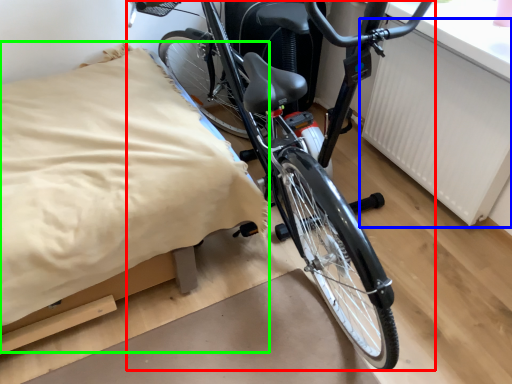
Question: Considering the real-world distances, which object is farthest from bicycle (highlighted by a red box)? radiator (highlighted by a blue box) or sheet (highlighted by a green box)?

Choices:
 (A) radiator
 (B) sheet

Answer: (A)